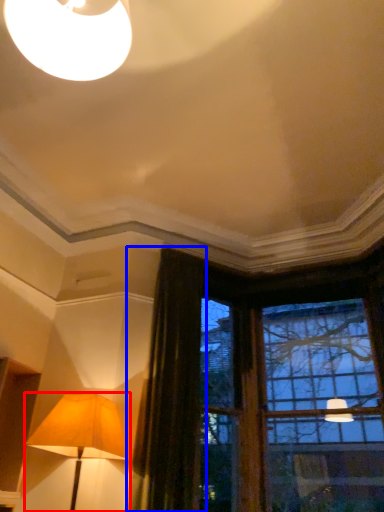
Question: Which object appears farthest to the camera in this image, lamp (highlighted by a red box) or curtain (highlighted by a blue box)?

Choices:
 (A) lamp
 (B) curtain

Answer: (B)